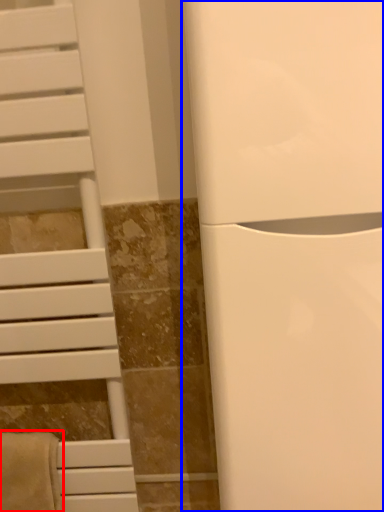
Question: Among these objects, which one is nearest to the camera, bath towel (highlighted by a red box) or appliance (highlighted by a blue box)?

Choices:
 (A) bath towel
 (B) appliance

Answer: (B)